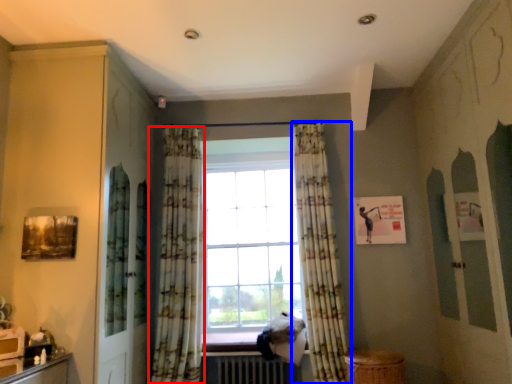
Question: Among these objects, which one is farthest to the camera, curtain (highlighted by a red box) or curtain (highlighted by a blue box)?

Choices:
 (A) curtain
 (B) curtain

Answer: (A)